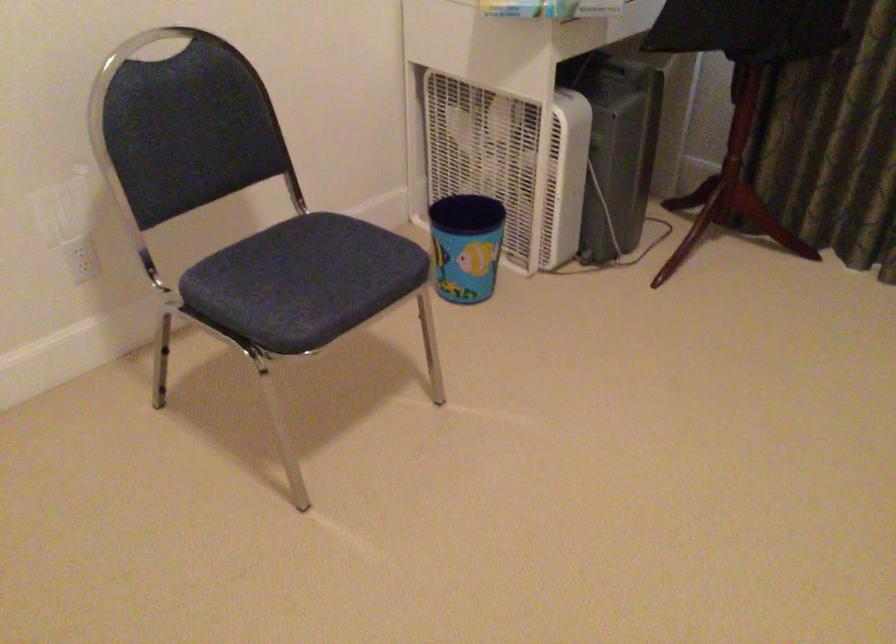
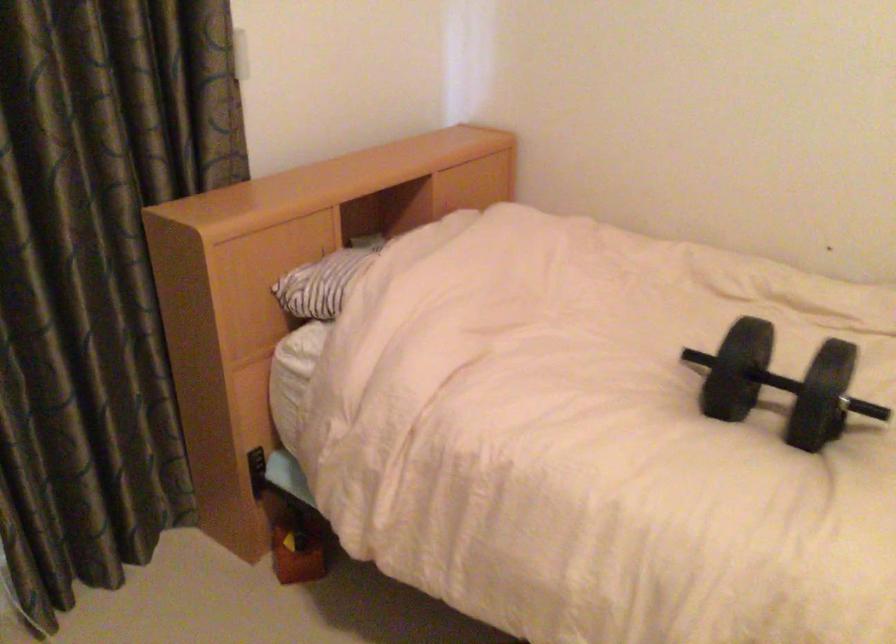
The first image is from the beginning of the video and the second image is from the end. How did the camera likely rotate when shooting the video?

The camera's rotation is toward right-down.